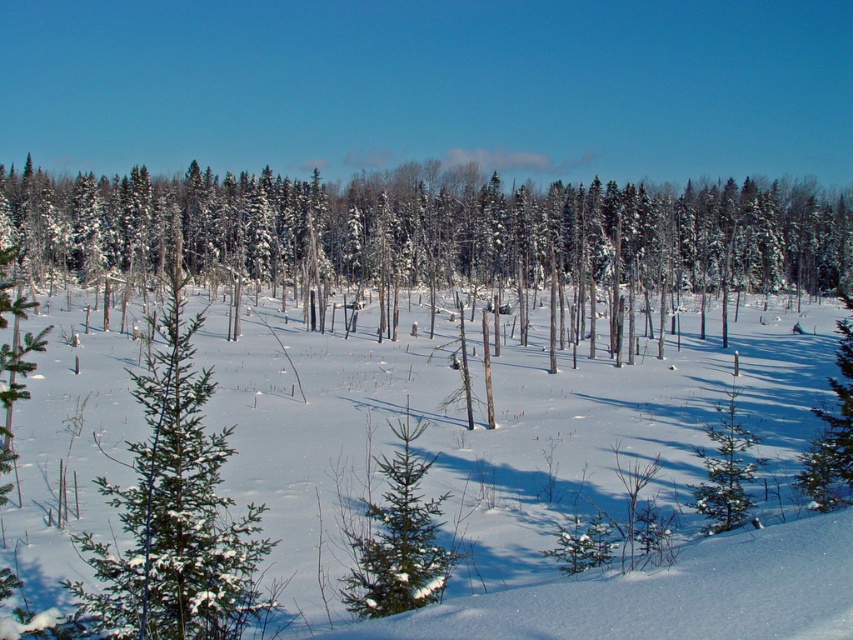
Question: Which point is closer to the camera?

Choices:
 (A) (196, 515)
 (B) (421, 552)

Answer: (A)

Question: Does white fluffy snow at center appear on the right side of green textured pine at center?

Choices:
 (A) yes
 (B) no

Answer: (B)

Question: Does white fluffy snow at center have a lesser width compared to green textured pine at center?

Choices:
 (A) no
 (B) yes

Answer: (A)

Question: Which object appears farthest from the camera in this image?

Choices:
 (A) white fluffy snow at center
 (B) green textured pine at center

Answer: (B)

Question: Considering the relative positions of white fluffy snow at center and green textured pine at center in the image provided, where is white fluffy snow at center located with respect to green textured pine at center?

Choices:
 (A) below
 (B) above

Answer: (B)